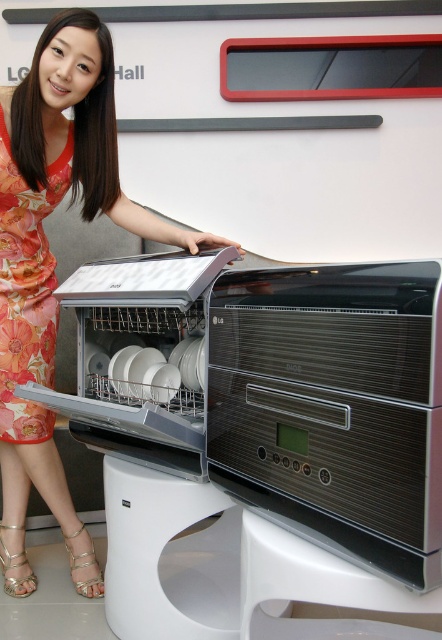
You are a delivery person who needs to place a new metallic silver dishwasher at center in the exact same position as the one shown in the image. What coordinates should you use to ensure it is placed correctly?

The metallic silver dishwasher at center should be placed at coordinates [274,392] to match the position shown in the image.

You are standing in front of the dishwasher at the exhibition. There are two points marked on the appliance. The first point is at coordinate point (323,480) and the second is at point (289,586). Which point would you touch first if you were to reach out to the dishwasher starting from the closest one?

Point (323,480) is closer to the viewer than point (289,586), so you would touch point (323,480) first.

You are a customer at the exhibition hall and want to know if the metallic silver dishwasher at center can fit in your kitchen space. Considering the size of the floral dress at center, which is worn by the salesperson, can you estimate whether the dishwasher will be too large for your kitchen?

The metallic silver dishwasher at center is smaller than the floral dress at center, so it should fit in most standard kitchen spaces. However, the size comparison with the dress is approximate and you should measure your available space for accuracy.